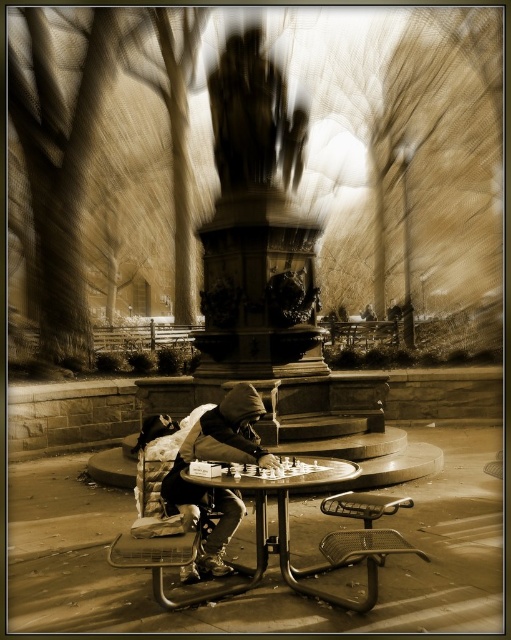
Between dark gray hoodie at center and smooth wooden table at center, which one is positioned lower?

smooth wooden table at center is lower down.

Which is in front, point (197, 458) or point (198, 598)?

Point (198, 598) is in front.

This screenshot has width=511, height=640. I want to click on dark gray hoodie at center, so click(x=218, y=445).